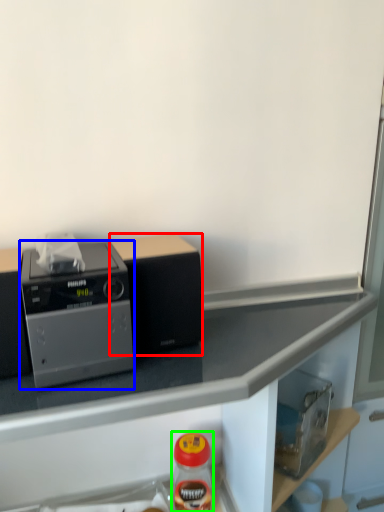
Question: Which object is positioned closest to appliance (highlighted by a red box)? Select from home appliance (highlighted by a blue box) and bottle (highlighted by a green box).

Choices:
 (A) home appliance
 (B) bottle

Answer: (A)